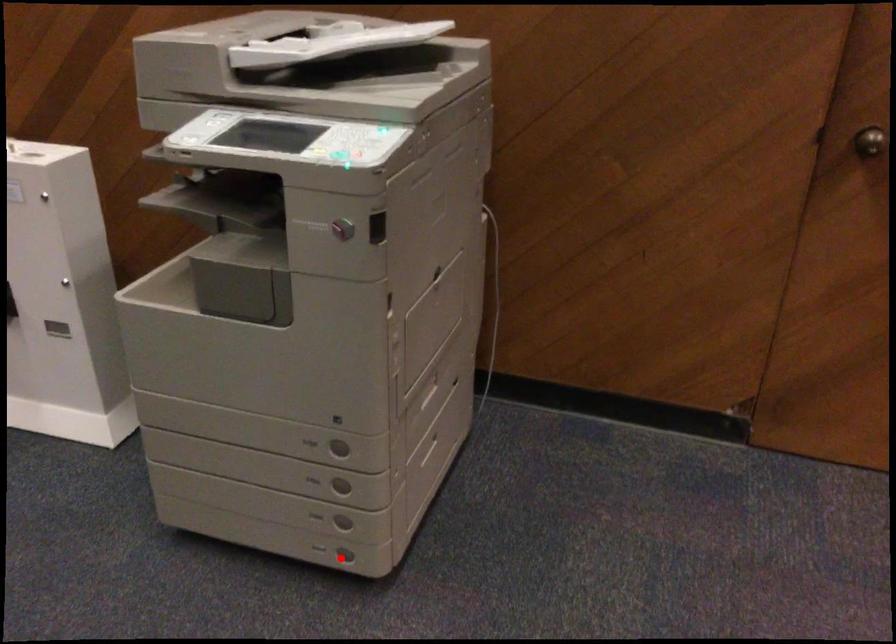
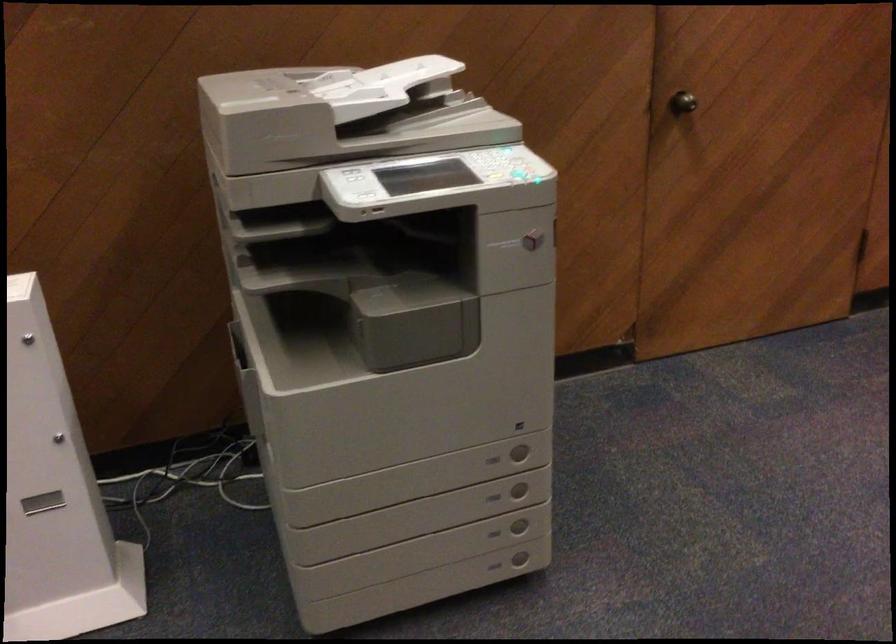
The point at the highlighted location is marked in the first image. Where is the corresponding point in the second image?

(520, 559)